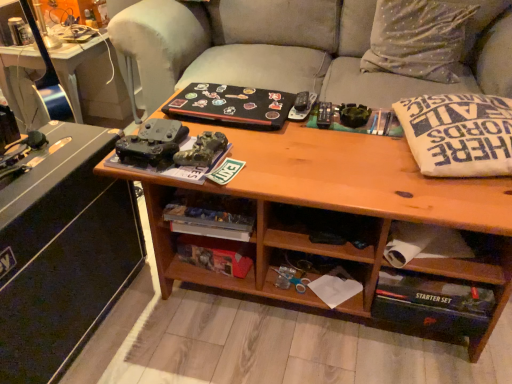
Question: Is matte black desk at left wider or thinner than black matte book at center, which ranks as the second book in bottom-to-top order?

Choices:
 (A) wide
 (B) thin

Answer: (A)

Question: Which is correct: matte black desk at left is inside black matte book at center, which ranks as the second book in bottom-to-top order, or outside of it?

Choices:
 (A) outside
 (B) inside

Answer: (A)

Question: Which is farther from the hardcover book at lower center, positioned as the 2th book in top-to-bottom order?

Choices:
 (A) gray fabric couch at center
 (B) black matte book at center, the 1th book from the top
 (C) metallic black game controllers at left
 (D) wooden drawer at lower right
 (E) silky silver pillow at upper right

Answer: (E)

Question: Which object is the closest to the hardcover book at lower center, positioned as the 2th book in top-to-bottom order?

Choices:
 (A) white cotton pillow at right
 (B) black matte book at center, which ranks as the second book in bottom-to-top order
 (C) metallic black game controllers at left
 (D) gray fabric couch at center
 (E) wooden drawer at lower right

Answer: (B)